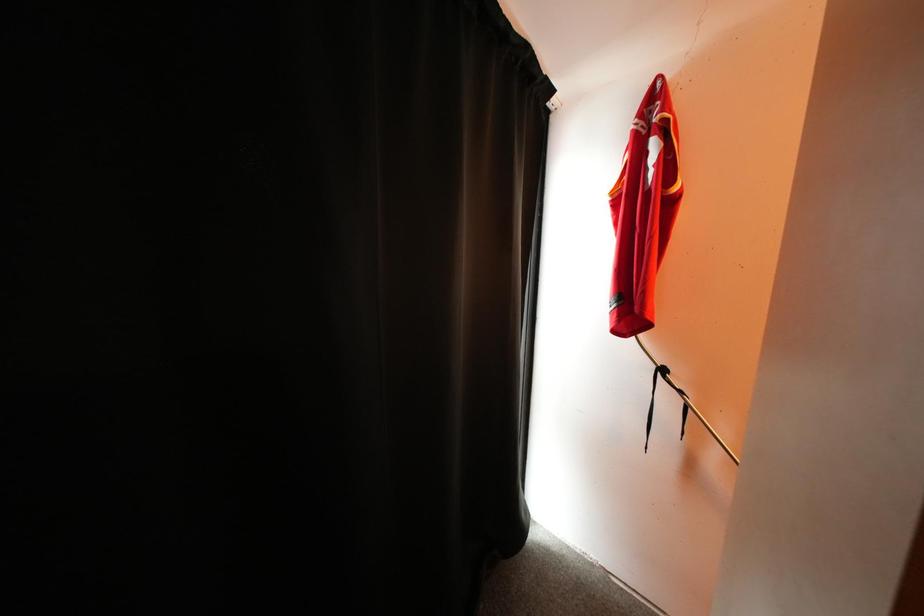
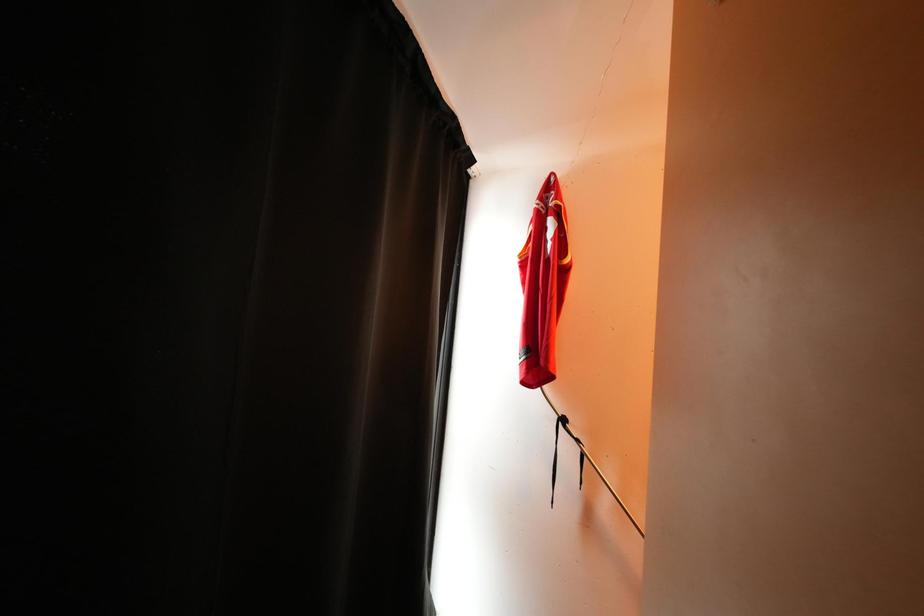
Question: The camera is either moving clockwise (left) or counter-clockwise (right) around the object. The first image is from the beginning of the video and the second image is from the end. Is the camera moving left or right when shooting the video?

Choices:
 (A) Left
 (B) Right

Answer: (A)